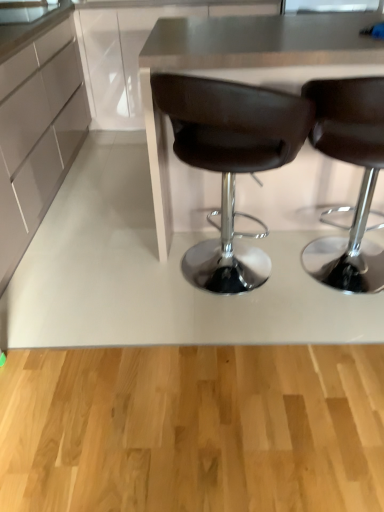
Locate an element on the screen. This screenshot has width=384, height=512. vacant space situated on the left part of brown leather chair at center, placed as the second chair when sorted from right to left is located at coordinates (117, 288).